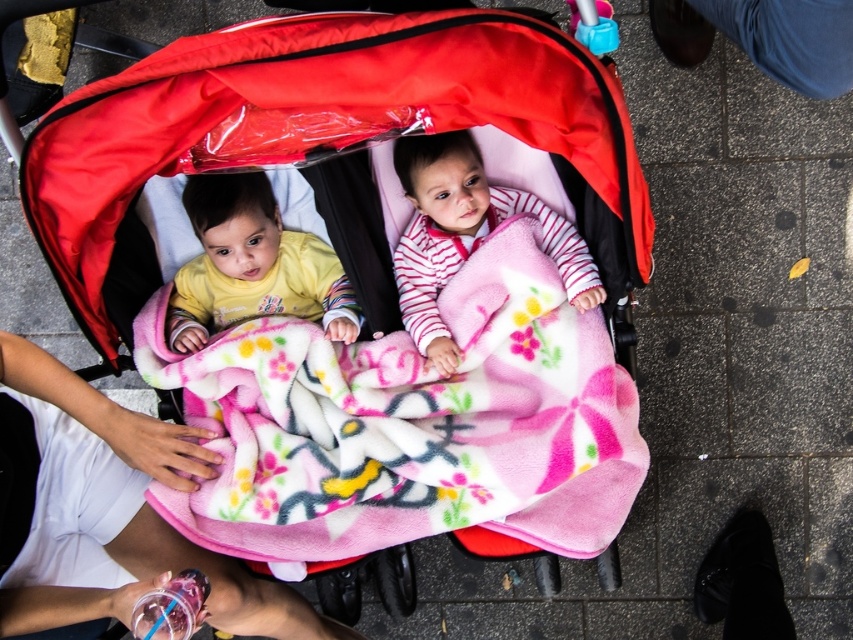
Question: Can you confirm if matte pink blanket at center is bigger than fluffy pink blanket at center?

Choices:
 (A) no
 (B) yes

Answer: (B)

Question: Among these points, which one is farthest from the camera?

Choices:
 (A) (129, 224)
 (B) (434, 288)
 (C) (136, 321)
 (D) (132, 470)

Answer: (B)

Question: Which object is positioned farthest from the yellow fleece toddler at upper left?

Choices:
 (A) matte pink blanket at center
 (B) fluffy pink blanket at center
 (C) pink fleece blanket at center

Answer: (C)

Question: Which object appears closest to the camera in this image?

Choices:
 (A) white fabric hand at lower left
 (B) yellow fleece toddler at upper left
 (C) pink fleece blanket at center
 (D) fluffy pink blanket at center

Answer: (A)

Question: Considering the relative positions of matte pink blanket at center and pink fleece blanket at center in the image provided, where is matte pink blanket at center located with respect to pink fleece blanket at center?

Choices:
 (A) left
 (B) right

Answer: (A)

Question: Does white fabric hand at lower left appear under yellow fleece toddler at upper left?

Choices:
 (A) no
 (B) yes

Answer: (B)